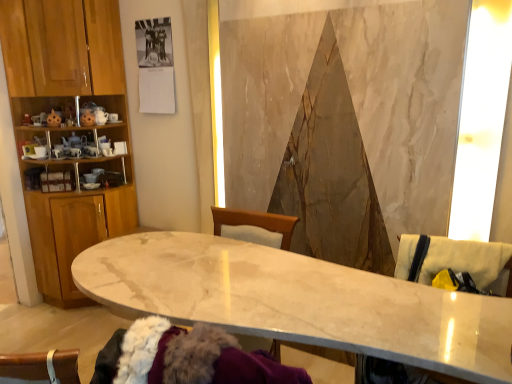
Question: Considering the positions of beige fabric swivel chair at right, the second swivel chair in the top-to-bottom sequence, and wooden cabinet at left in the image, is beige fabric swivel chair at right, the second swivel chair in the top-to-bottom sequence, wider or thinner than wooden cabinet at left?

Choices:
 (A) wide
 (B) thin

Answer: (A)

Question: Based on their positions, is beige fabric swivel chair at right, which is the 1th swivel chair from bottom to top, located to the left or right of wooden cabinet at left?

Choices:
 (A) right
 (B) left

Answer: (A)

Question: Which object is positioned farthest from the beige fabric swivel chair at right, which is the 1th swivel chair from bottom to top?

Choices:
 (A) wooden cabinet at left
 (B) beige fabric swivel chair at right, which ranks as the first swivel chair in top-to-bottom order
 (C) marble table at center

Answer: (A)

Question: Based on their relative distances, which object is farther from the wooden cabinet at left?

Choices:
 (A) marble table at center
 (B) beige fabric swivel chair at right, which is the 1th swivel chair from bottom to top
 (C) beige fabric swivel chair at right, which ranks as the first swivel chair in top-to-bottom order

Answer: (C)